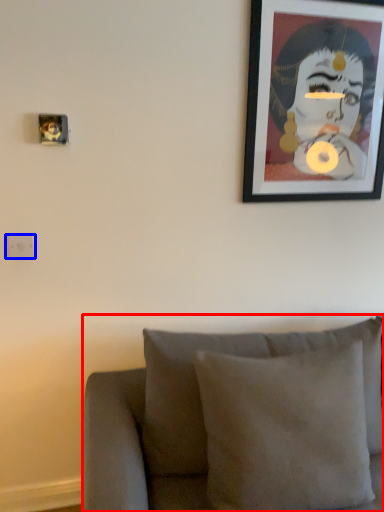
Question: Which point is further to the camera, furniture (highlighted by a red box) or electric outlet (highlighted by a blue box)?

Choices:
 (A) furniture
 (B) electric outlet

Answer: (B)